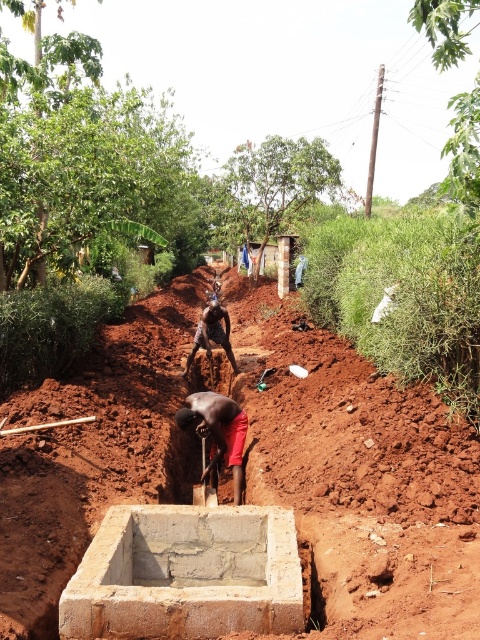
Does point (301, 483) come closer to viewer compared to point (228, 342)?

Yes, point (301, 483) is in front of point (228, 342).

Which is more to the left, reddish-brown soil at center or metallic bronze statue at center?

reddish-brown soil at center

Find the location of a particular element. This screenshot has height=640, width=480. reddish-brown soil at center is located at coordinates (360, 477).

Is point (101, 632) less distant than point (212, 401)?

That is True.

Is light gray concrete foundation at center smaller than dark skin person at center?

Incorrect, light gray concrete foundation at center is not smaller in size than dark skin person at center.

You are a GUI agent. You are given a task and a screenshot of the screen. Output one action in this format:
    pyautogui.click(x=<x>, y=<y>)
    Task: Click on the light gray concrete foundation at center
    
    Given the screenshot: What is the action you would take?
    pyautogui.click(x=186, y=573)

Can you confirm if dark skin person at center is taller than metallic bronze statue at center?

Yes, dark skin person at center is taller than metallic bronze statue at center.

Can you confirm if dark skin person at center is smaller than metallic bronze statue at center?

Incorrect, dark skin person at center is not smaller in size than metallic bronze statue at center.

Which is in front, point (208, 429) or point (195, 337)?

Point (208, 429) is in front.

Identify the location of dark skin person at center. (217, 433).